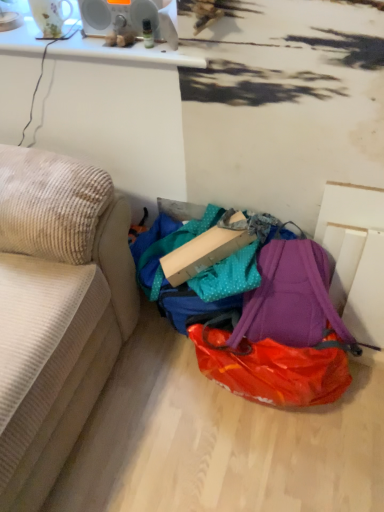
What do you see at coordinates (56, 311) in the screenshot? Image resolution: width=384 pixels, height=512 pixels. I see `beige corduroy couch at left` at bounding box center [56, 311].

What do you see at coordinates (202, 253) in the screenshot? This screenshot has width=384, height=512. I see `cardboard box at center` at bounding box center [202, 253].

Locate an element on the screen. This screenshot has height=512, width=384. beige corduroy couch at left is located at coordinates (56, 311).

The height and width of the screenshot is (512, 384). Find the location of `bag located on the right of cardboard box at center`. bag located on the right of cardboard box at center is located at coordinates (281, 333).

Is cardboard box at center located outside purple fabric backpack at lower center?

No, most part of cardboard box at center lies within purple fabric backpack at lower center.

Are cardboard box at center and purple fabric backpack at lower center far apart?

Actually, cardboard box at center and purple fabric backpack at lower center are a little close together.

Considering the positions of objects cardboard box at center and purple fabric backpack at lower center in the image provided, who is in front, cardboard box at center or purple fabric backpack at lower center?

Positioned in front is purple fabric backpack at lower center.

Are purple fabric backpack at lower center and cardboard box at center beside each other?

purple fabric backpack at lower center and cardboard box at center are not in contact.

From a real-world perspective, is purple fabric backpack at lower center positioned under cardboard box at center based on gravity?

Yes, from a real-world perspective, purple fabric backpack at lower center is under cardboard box at center.

From the picture: Is purple fabric backpack at lower center bigger than cardboard box at center?

Yes.

In terms of height, does cardboard box at center look taller or shorter compared to beige corduroy couch at left?

Clearly, cardboard box at center is shorter compared to beige corduroy couch at left.

Consider the image. Could you tell me if cardboard box at center is facing beige corduroy couch at left?

No.

From the image's perspective, does cardboard box at center appear lower than beige corduroy couch at left?

Actually, cardboard box at center appears above beige corduroy couch at left in the image.

Are cardboard box at center and beige corduroy couch at left located far from each other?

No, there isn't a large distance between cardboard box at center and beige corduroy couch at left.

How many degrees apart are the facing directions of beige corduroy couch at left and cardboard box at center?

beige corduroy couch at left and cardboard box at center are facing 52.8 degrees away from each other.

From the picture: Is cardboard box at center at the back of beige corduroy couch at left?

No, beige corduroy couch at left is not facing the opposite direction of cardboard box at center.

Locate an element on the screen. Image resolution: width=384 pixels, height=512 pixels. cardboard box above the beige corduroy couch at left (from the image's perspective) is located at coordinates (202, 253).

From a real-world perspective, is beige corduroy couch at left beneath cardboard box at center?

No, from a real-world perspective, beige corduroy couch at left is not under cardboard box at center.

Where is `bag beneath the beige corduroy couch at left (from a real-world perspective)`? This screenshot has height=512, width=384. bag beneath the beige corduroy couch at left (from a real-world perspective) is located at coordinates (281, 333).

Is beige corduroy couch at left to the left of purple fabric backpack at lower center from the viewer's perspective?

Yes.

Is beige corduroy couch at left a part of purple fabric backpack at lower center?

No, beige corduroy couch at left is located outside of purple fabric backpack at lower center.

Is purple fabric backpack at lower center far away from beige corduroy couch at left?

Actually, purple fabric backpack at lower center and beige corduroy couch at left are a little close together.

Does purple fabric backpack at lower center have a larger size compared to beige corduroy couch at left?

No, purple fabric backpack at lower center is not bigger than beige corduroy couch at left.

From the image's perspective, is purple fabric backpack at lower center above or below beige corduroy couch at left?

purple fabric backpack at lower center is situated lower than beige corduroy couch at left in the image.

Image resolution: width=384 pixels, height=512 pixels. In order to click on bag in front of the cardboard box at center in this screenshot , I will do `click(281, 333)`.

Locate an element on the screen. cardboard box above the purple fabric backpack at lower center (from the image's perspective) is located at coordinates 202,253.

Based on their spatial positions, is purple fabric backpack at lower center or cardboard box at center further from beige corduroy couch at left?

purple fabric backpack at lower center lies further to beige corduroy couch at left than the other object.

When comparing their distances from purple fabric backpack at lower center, does beige corduroy couch at left or cardboard box at center seem further?

beige corduroy couch at left is further to purple fabric backpack at lower center.

When comparing their distances from cardboard box at center, does beige corduroy couch at left or purple fabric backpack at lower center seem closer?

purple fabric backpack at lower center lies closer to cardboard box at center than the other object.

From the image, which object appears to be farther from beige corduroy couch at left, cardboard box at center or purple fabric backpack at lower center?

Among the two, purple fabric backpack at lower center is located further to beige corduroy couch at left.

Looking at the image, which one is located closer to purple fabric backpack at lower center, cardboard box at center or beige corduroy couch at left?

cardboard box at center is positioned closer to the anchor purple fabric backpack at lower center.

From the image, which object appears to be nearer to cardboard box at center, purple fabric backpack at lower center or beige corduroy couch at left?

purple fabric backpack at lower center is closer to cardboard box at center.

Locate an element on the screen. cardboard box between beige corduroy couch at left and purple fabric backpack at lower center in the horizontal direction is located at coordinates (202, 253).